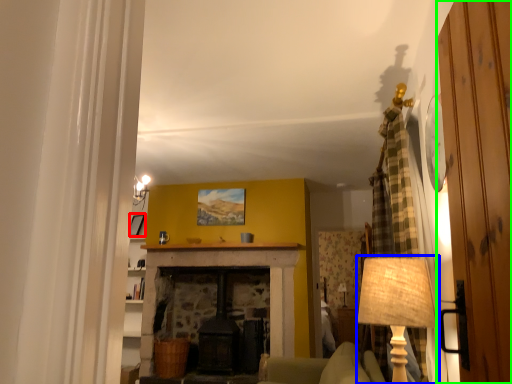
Question: Estimate the real-world distances between objects in this image. Which object is farther from picture frame (highlighted by a red box), table lamp (highlighted by a blue box) or door (highlighted by a green box)?

Choices:
 (A) table lamp
 (B) door

Answer: (B)